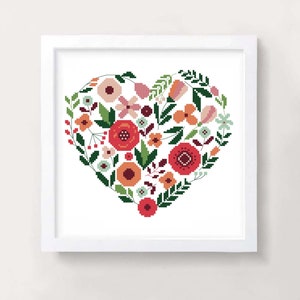
Identify the location of corner. (250, 251), (47, 252), (251, 37), (42, 43).